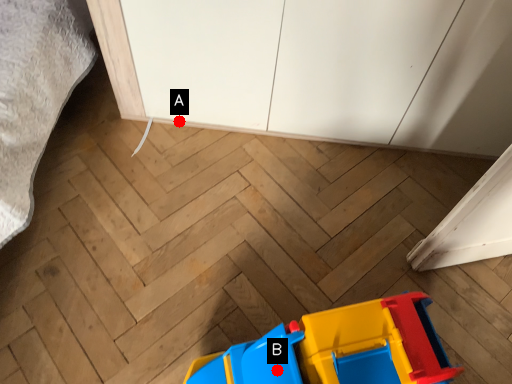
Question: Two points are circled on the image, labeled by A and B beside each circle. Which point is further to the camera?

Choices:
 (A) A is further
 (B) B is further

Answer: (A)